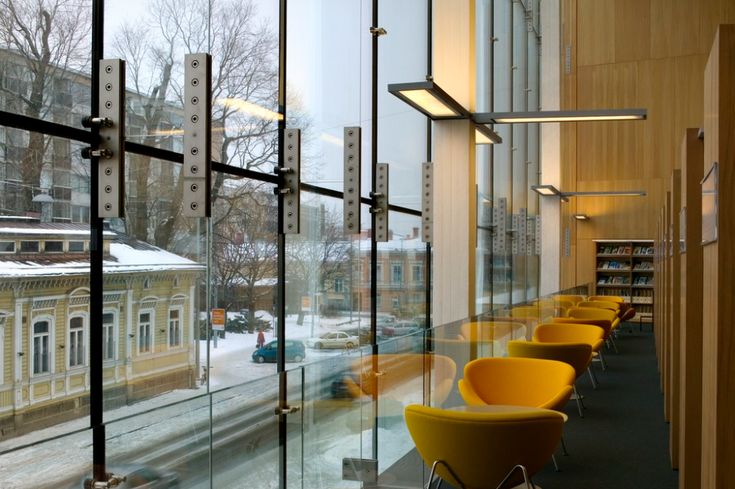
Find the location of a particular element. The height and width of the screenshot is (489, 735). wood wall panel is located at coordinates (x=664, y=107).